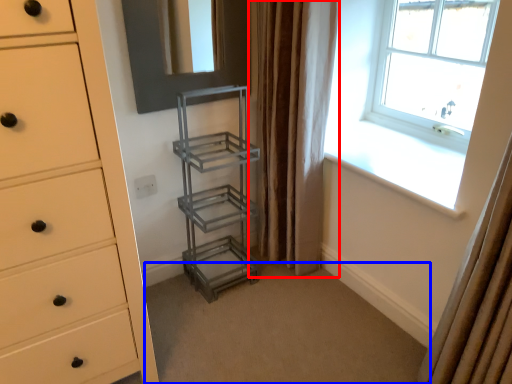
Question: Which point is further to the camera, curtain (highlighted by a red box) or plain (highlighted by a blue box)?

Choices:
 (A) curtain
 (B) plain

Answer: (A)